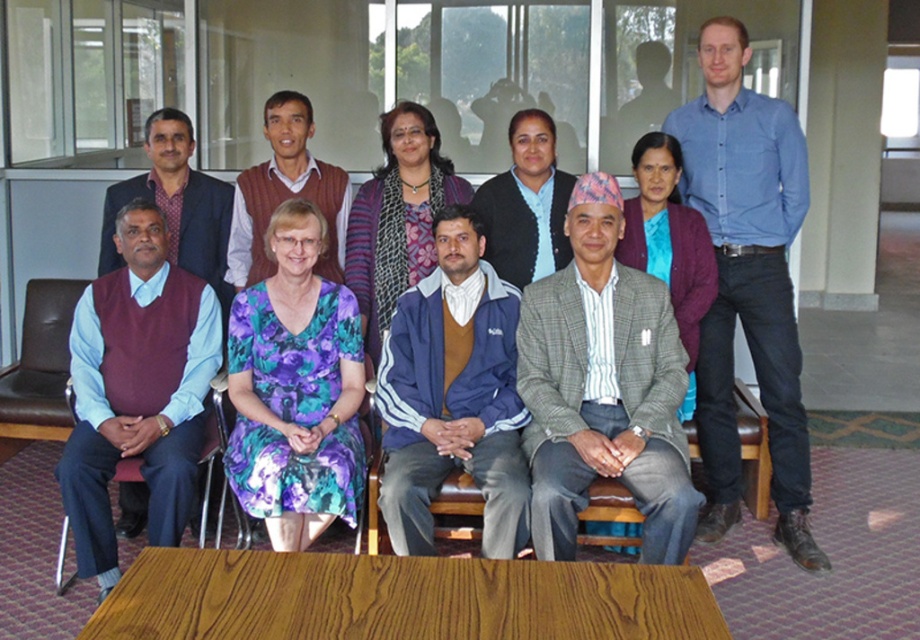
Question: Which of the following is the farthest from the observer?

Choices:
 (A) plaid woolen blazer at center
 (B) maroon sweater at center
 (C) brown leather chair at lower left

Answer: (B)

Question: Among these objects, which one is nearest to the camera?

Choices:
 (A) black woolen sweater at center
 (B) blue denim shirt at upper right
 (C) blue floral dress at center

Answer: (B)

Question: Is plaid woolen blazer at center behind black woolen sweater at center?

Choices:
 (A) no
 (B) yes

Answer: (A)

Question: Does blue fabric jacket at center appear on the right side of wooden chair at lower left?

Choices:
 (A) yes
 (B) no

Answer: (A)

Question: Does blue denim shirt at upper right appear under brown leather chair at lower left?

Choices:
 (A) no
 (B) yes

Answer: (A)

Question: Which of the following is the farthest from the observer?

Choices:
 (A) (355, 436)
 (B) (502, 304)

Answer: (B)